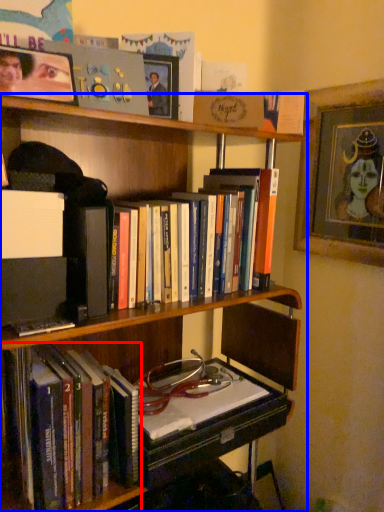
Question: Among these objects, which one is nearest to the camera, book (highlighted by a red box) or bookcase (highlighted by a blue box)?

Choices:
 (A) book
 (B) bookcase

Answer: (B)